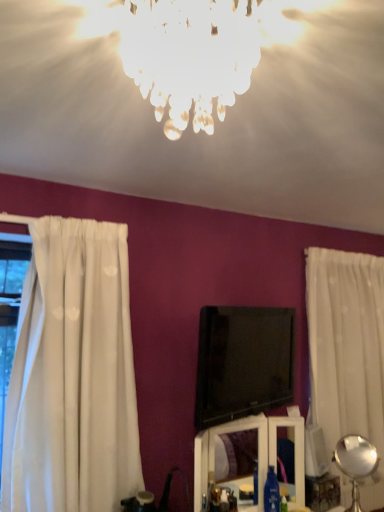
In order to click on icy glass chandelier at upper center, which ranks as the second lamp in bottom-to-top order in this screenshot , I will do `click(190, 56)`.

What is the approximate height of white glossy vanity at lower center?

white glossy vanity at lower center is 48.58 centimeters in height.

At what (x,y) coordinates should I click in order to perform the action: click on metallic silver lamp at lower right, marked as the second lamp in a front-to-back arrangement. Please return your answer as a coordinate pair (x, y). The height and width of the screenshot is (512, 384). Looking at the image, I should click on (356, 463).

From the image's perspective, which is above, icy glass chandelier at upper center, the first lamp viewed from the front, or white glossy vanity at lower center?

icy glass chandelier at upper center, the first lamp viewed from the front, from the image's perspective.

Which is behind, icy glass chandelier at upper center, positioned as the 2th lamp in right-to-left order, or white glossy vanity at lower center?

white glossy vanity at lower center is behind.

Between icy glass chandelier at upper center, the first lamp viewed from the front, and white glossy vanity at lower center, which one appears on the left side from the viewer's perspective?

Positioned to the left is icy glass chandelier at upper center, the first lamp viewed from the front.

Is icy glass chandelier at upper center, the 2th lamp in the back-to-front sequence, outside of white glossy vanity at lower center?

icy glass chandelier at upper center, the 2th lamp in the back-to-front sequence, is positioned outside white glossy vanity at lower center.

Which is closer, (221, 65) or (243, 407)?

Clearly, point (221, 65) is closer to the camera than point (243, 407).

From the image's perspective, between icy glass chandelier at upper center, which appears as the 1th lamp when viewed from the left, and black glossy tv at center, who is located below?

From the image's view, black glossy tv at center is below.

Could you measure the distance between icy glass chandelier at upper center, the first lamp viewed from the front, and black glossy tv at center?

4.75 feet.

Consider the image. Is icy glass chandelier at upper center, the first lamp viewed from the front, behind black glossy tv at center?

No, it is not.

At what (x,y) coordinates should I click in order to perform the action: click on vanity located below the white sheer curtain at right (from the image's perspective). Please return your answer as a coordinate pair (x, y). Looking at the image, I should click on (258, 454).

Does point (194, 473) come farther from viewer compared to point (363, 500)?

No, (194, 473) is in front of (363, 500).

Can you tell me how much white glossy vanity at lower center and white sheer curtain at right differ in facing direction?

white glossy vanity at lower center and white sheer curtain at right are facing 5.92 degrees away from each other.

Which of these two, white glossy vanity at lower center or white sheer curtain at right, is wider?

white sheer curtain at right is wider.

Is point (268, 380) behind point (367, 313)?

No, it is not.

How different are the orientations of black glossy tv at center and white sheer curtain at right in degrees?

They differ by 16.8 degrees in their facing directions.

Which object is positioned more to the right, black glossy tv at center or white sheer curtain at right?

From the viewer's perspective, white sheer curtain at right appears more on the right side.

Is black glossy tv at center situated inside white sheer curtain at right or outside?

black glossy tv at center is not enclosed by white sheer curtain at right.

Could white sheer curtain at right be considered to be inside icy glass chandelier at upper center, positioned as the 2th lamp in right-to-left order?

No, white sheer curtain at right is not inside icy glass chandelier at upper center, positioned as the 2th lamp in right-to-left order.

Measure the distance from icy glass chandelier at upper center, positioned as the 2th lamp in right-to-left order, to white sheer curtain at right.

icy glass chandelier at upper center, positioned as the 2th lamp in right-to-left order, and white sheer curtain at right are 2.08 meters apart.

Is icy glass chandelier at upper center, which ranks as the second lamp in bottom-to-top order, further to the viewer compared to white sheer curtain at right?

No, it is not.

Is black glossy tv at center not within icy glass chandelier at upper center, the first lamp viewed from the front?

That's correct, black glossy tv at center is outside of icy glass chandelier at upper center, the first lamp viewed from the front.

Considering the sizes of black glossy tv at center and icy glass chandelier at upper center, which appears as the 1th lamp when viewed from the top, in the image, is black glossy tv at center taller or shorter than icy glass chandelier at upper center, which appears as the 1th lamp when viewed from the top,?

Considering their sizes, black glossy tv at center has more height than icy glass chandelier at upper center, which appears as the 1th lamp when viewed from the top.

Based on their positions, is black glossy tv at center located to the left or right of icy glass chandelier at upper center, which appears as the 1th lamp when viewed from the left?

In the image, black glossy tv at center appears on the right side of icy glass chandelier at upper center, which appears as the 1th lamp when viewed from the left.

Can you tell me how much black glossy tv at center and icy glass chandelier at upper center, positioned as the 2th lamp in right-to-left order, differ in facing direction?

78 degrees.

Is white glossy vanity at lower center taller than black glossy tv at center?

No.

Is black glossy tv at center at the back of white glossy vanity at lower center?

No, black glossy tv at center is not at the back of white glossy vanity at lower center.

How different are the orientations of white glossy vanity at lower center and black glossy tv at center in degrees?

white glossy vanity at lower center and black glossy tv at center are facing 10.9 degrees away from each other.

Which object is positioned more to the left, white glossy vanity at lower center or black glossy tv at center?

Positioned to the left is white glossy vanity at lower center.

Where is `lamp above the white glossy vanity at lower center (from the image's perspective)`? This screenshot has width=384, height=512. lamp above the white glossy vanity at lower center (from the image's perspective) is located at coordinates (190, 56).

Image resolution: width=384 pixels, height=512 pixels. Find the location of `lamp on the left of black glossy tv at center`. lamp on the left of black glossy tv at center is located at coordinates (190, 56).

In the scene shown: Looking at the image, which one is located closer to white glossy vanity at lower center, white sheer curtain at right or icy glass chandelier at upper center, which appears as the 1th lamp when viewed from the top?

The object closer to white glossy vanity at lower center is white sheer curtain at right.

Estimate the real-world distances between objects in this image. Which object is further from icy glass chandelier at upper center, which appears as the 1th lamp when viewed from the top, metallic silver lamp at lower right, which is counted as the first lamp, starting from the right, or white glossy vanity at lower center?

metallic silver lamp at lower right, which is counted as the first lamp, starting from the right, is further to icy glass chandelier at upper center, which appears as the 1th lamp when viewed from the top.

Which object lies further to the anchor point icy glass chandelier at upper center, which appears as the 1th lamp when viewed from the left, white sheer curtain at right or black glossy tv at center?

Among the two, white sheer curtain at right is located further to icy glass chandelier at upper center, which appears as the 1th lamp when viewed from the left.

Looking at the image, which one is located closer to black glossy tv at center, metallic silver lamp at lower right, which is counted as the first lamp, starting from the right, or white glossy vanity at lower center?

white glossy vanity at lower center is positioned closer to the anchor black glossy tv at center.

From the image, which object appears to be nearer to white sheer curtain at right, metallic silver lamp at lower right, arranged as the second lamp when viewed from the left, or black glossy tv at center?

black glossy tv at center is positioned closer to the anchor white sheer curtain at right.

Estimate the real-world distances between objects in this image. Which object is closer to metallic silver lamp at lower right, acting as the 1th lamp starting from the bottom, icy glass chandelier at upper center, positioned as the 2th lamp in right-to-left order, or white glossy vanity at lower center?

white glossy vanity at lower center.

Considering their positions, is white glossy vanity at lower center positioned further to white sheer curtain at right than metallic silver lamp at lower right, which is counted as the first lamp, starting from the right?

Among the two, white glossy vanity at lower center is located further to white sheer curtain at right.

From the image, which object appears to be nearer to metallic silver lamp at lower right, positioned as the first lamp in back-to-front order, white sheer curtain at right or black glossy tv at center?

white sheer curtain at right is positioned closer to the anchor metallic silver lamp at lower right, positioned as the first lamp in back-to-front order.

This screenshot has width=384, height=512. In order to click on lamp between icy glass chandelier at upper center, the first lamp viewed from the front, and white sheer curtain at right in the front-back direction in this screenshot , I will do `click(356, 463)`.

Where is `vanity between black glossy tv at center and metallic silver lamp at lower right, arranged as the second lamp when viewed from the left, from top to bottom`? The width and height of the screenshot is (384, 512). vanity between black glossy tv at center and metallic silver lamp at lower right, arranged as the second lamp when viewed from the left, from top to bottom is located at coordinates pyautogui.click(x=258, y=454).

You are a GUI agent. You are given a task and a screenshot of the screen. Output one action in this format:
    pyautogui.click(x=<x>, y=<y>)
    Task: Click on the television situated between white glossy vanity at lower center and white sheer curtain at right from left to right
    This screenshot has height=512, width=384.
    Given the screenshot: What is the action you would take?
    pyautogui.click(x=243, y=362)

Where is `lamp situated between white glossy vanity at lower center and white sheer curtain at right from left to right`? lamp situated between white glossy vanity at lower center and white sheer curtain at right from left to right is located at coordinates (356, 463).